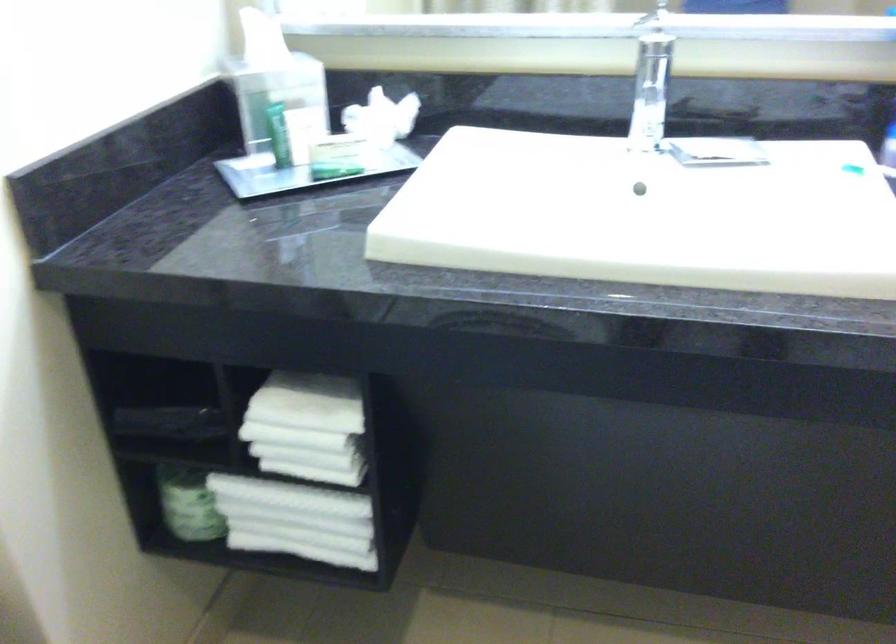
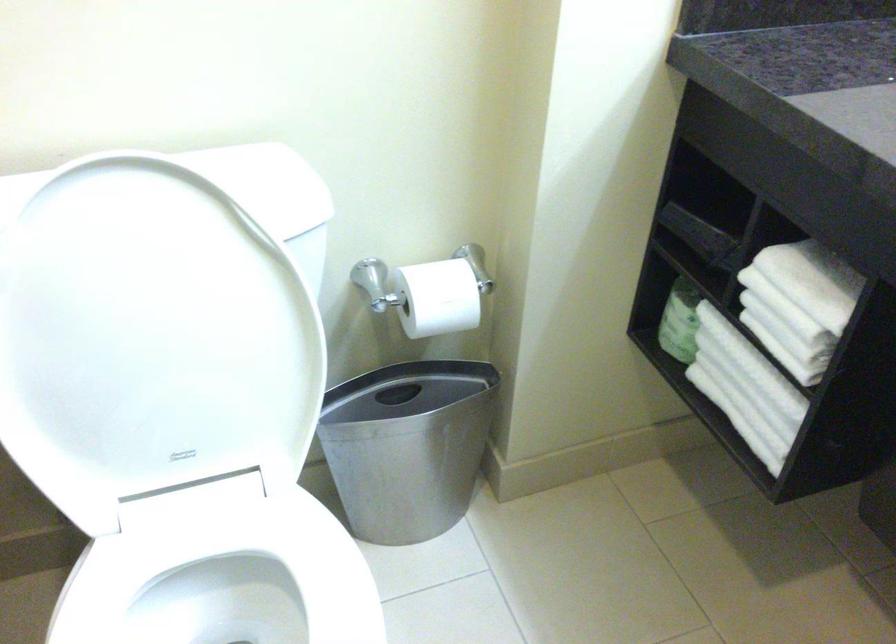
Locate, in the second image, the point that corresponds to (192,505) in the first image.

(679, 321)